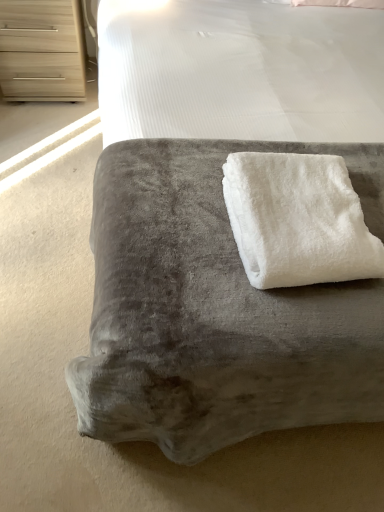
Where is `velvet gray ottoman at center`? Image resolution: width=384 pixels, height=512 pixels. velvet gray ottoman at center is located at coordinates (216, 311).

Considering the relative sizes of velvet gray ottoman at center and white fluffy towel at center in the image provided, is velvet gray ottoman at center taller than white fluffy towel at center?

Yes.

Is velvet gray ottoman at center spatially inside white fluffy towel at center, or outside of it?

velvet gray ottoman at center is not inside white fluffy towel at center, it's outside.

Are velvet gray ottoman at center and white fluffy towel at center making contact?

velvet gray ottoman at center is not next to white fluffy towel at center, and they're not touching.

From the image's perspective, relative to white fluffy towel at center, is velvet gray ottoman at center above or below?

From the image's perspective, velvet gray ottoman at center appears below white fluffy towel at center.

Is light wood chest of drawers at upper left positioned with its back to velvet gray ottoman at center?

That's not correct — light wood chest of drawers at upper left is not looking away from velvet gray ottoman at center.

Is light wood chest of drawers at upper left positioned behind velvet gray ottoman at center?

Yes, light wood chest of drawers at upper left is further from the viewer.

From the image's perspective, is light wood chest of drawers at upper left above velvet gray ottoman at center?

Correct, light wood chest of drawers at upper left appears higher than velvet gray ottoman at center in the image.

Are white fluffy towel at center and velvet gray ottoman at center far apart?

They are positioned close to each other.

Which object is further away from the camera, white fluffy towel at center or velvet gray ottoman at center?

white fluffy towel at center is behind.

Looking at this image, can light wood chest of drawers at upper left be found inside white fluffy towel at center?

No.

Considering the sizes of white fluffy towel at center and light wood chest of drawers at upper left in the image, is white fluffy towel at center taller or shorter than light wood chest of drawers at upper left?

Considering their sizes, white fluffy towel at center has less height than light wood chest of drawers at upper left.

Is white fluffy towel at center bigger than light wood chest of drawers at upper left?

No.

Does velvet gray ottoman at center lie behind light wood chest of drawers at upper left?

No, it is in front of light wood chest of drawers at upper left.

Where is `the chest of drawers that appears below the velvet gray ottoman at center (from a real-world perspective)`? the chest of drawers that appears below the velvet gray ottoman at center (from a real-world perspective) is located at coordinates (41, 50).

From the picture: How much distance is there between velvet gray ottoman at center and light wood chest of drawers at upper left?

velvet gray ottoman at center and light wood chest of drawers at upper left are 4.31 feet apart.

What's the angular difference between velvet gray ottoman at center and light wood chest of drawers at upper left's facing directions?

velvet gray ottoman at center and light wood chest of drawers at upper left are facing 0.031 degrees away from each other.

Where is `chest of drawers below the white fluffy towel at center (from a real-world perspective)`? The image size is (384, 512). chest of drawers below the white fluffy towel at center (from a real-world perspective) is located at coordinates (41, 50).

Is light wood chest of drawers at upper left taller or shorter than white fluffy towel at center?

Considering their sizes, light wood chest of drawers at upper left has more height than white fluffy towel at center.

In the scene shown: Is light wood chest of drawers at upper left wider or thinner than white fluffy towel at center?

Considering their sizes, light wood chest of drawers at upper left looks slimmer than white fluffy towel at center.

From a real-world perspective, relative to white fluffy towel at center, is light wood chest of drawers at upper left vertically above or below?

In terms of real-world spatial position, light wood chest of drawers at upper left is below white fluffy towel at center.

Where is `furniture beneath the white fluffy towel at center (from a real-world perspective)`? The image size is (384, 512). furniture beneath the white fluffy towel at center (from a real-world perspective) is located at coordinates coord(216,311).

You are a GUI agent. You are given a task and a screenshot of the screen. Output one action in this format:
    pyautogui.click(x=<x>, y=<y>)
    Task: Click on the chest of drawers lying above the velvet gray ottoman at center (from the image's perspective)
    Image resolution: width=384 pixels, height=512 pixels.
    Given the screenshot: What is the action you would take?
    pyautogui.click(x=41, y=50)

From the image, which object appears to be farther from velvet gray ottoman at center, light wood chest of drawers at upper left or white fluffy towel at center?

Based on the image, light wood chest of drawers at upper left appears to be further to velvet gray ottoman at center.

When comparing their distances from light wood chest of drawers at upper left, does velvet gray ottoman at center or white fluffy towel at center seem closer?

velvet gray ottoman at center.

From the image, which object appears to be farther from light wood chest of drawers at upper left, white fluffy towel at center or velvet gray ottoman at center?

The object further to light wood chest of drawers at upper left is white fluffy towel at center.

From the image, which object appears to be farther from velvet gray ottoman at center, white fluffy towel at center or light wood chest of drawers at upper left?

Among the two, light wood chest of drawers at upper left is located further to velvet gray ottoman at center.

When comparing their distances from white fluffy towel at center, does velvet gray ottoman at center or light wood chest of drawers at upper left seem further?

light wood chest of drawers at upper left lies further to white fluffy towel at center than the other object.

Consider the image. Looking at the image, which one is located further to white fluffy towel at center, light wood chest of drawers at upper left or velvet gray ottoman at center?

light wood chest of drawers at upper left is further to white fluffy towel at center.

You are a GUI agent. You are given a task and a screenshot of the screen. Output one action in this format:
    pyautogui.click(x=<x>, y=<y>)
    Task: Click on the towel between light wood chest of drawers at upper left and velvet gray ottoman at center vertically
    The width and height of the screenshot is (384, 512).
    Given the screenshot: What is the action you would take?
    pyautogui.click(x=298, y=220)